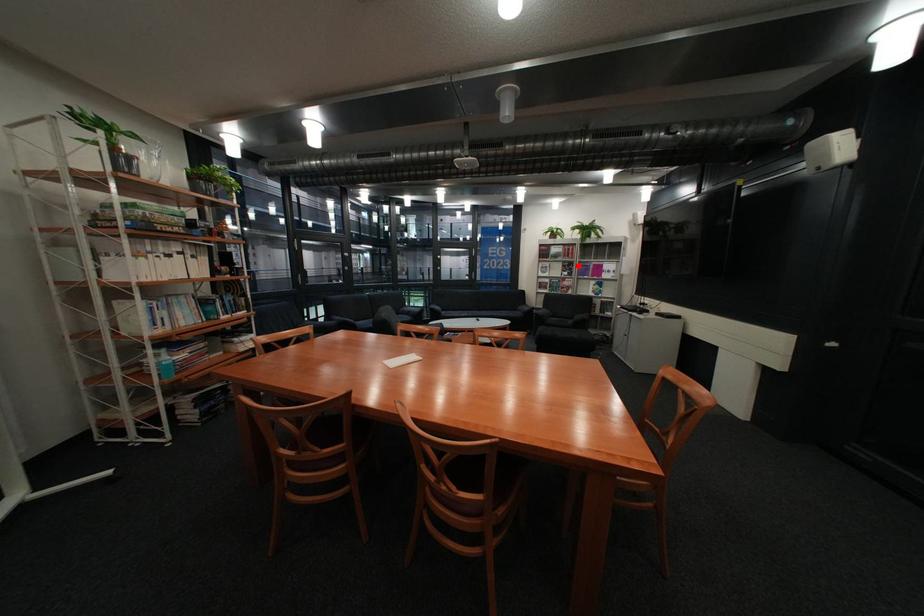
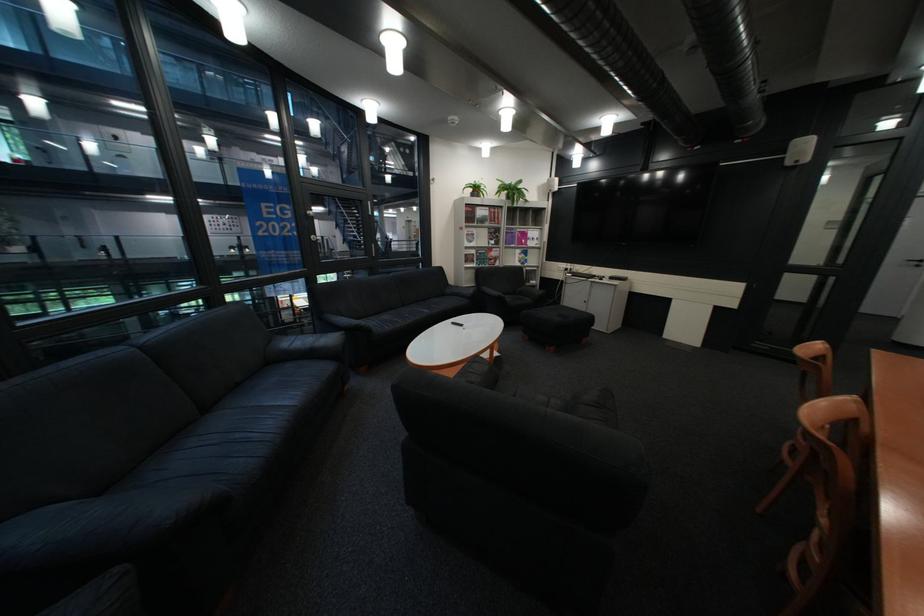
Locate, in the second image, the point that corresponds to the highlighted location in the first image.

(505, 233)